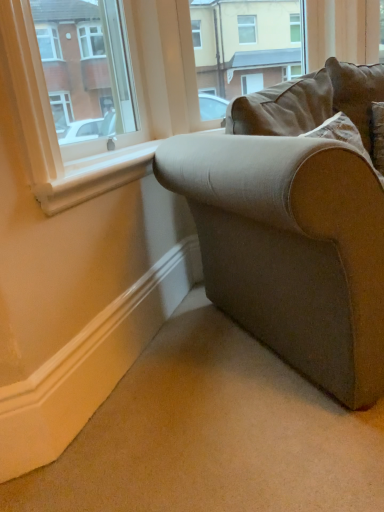
At what (x,y) coordinates should I click in order to perform the action: click on matte white window at upper left. Please return your answer as a coordinate pair (x, y). Looking at the image, I should click on (54, 129).

Locate an element on the screen. The width and height of the screenshot is (384, 512). brown fabric couch at upper right is located at coordinates pyautogui.click(x=244, y=46).

Where is `white painted wood at lower left`? This screenshot has width=384, height=512. white painted wood at lower left is located at coordinates (94, 176).

At what (x,y) coordinates should I click in order to perform the action: click on textured beige couch at lower right. Please return your answer as a coordinate pair (x, y). Looking at the image, I should click on (295, 225).

The width and height of the screenshot is (384, 512). Find the location of `matte white window at upper left`. matte white window at upper left is located at coordinates (54, 129).

Considering the relative sizes of brown fabric couch at upper right and matte white window at upper left in the image provided, is brown fabric couch at upper right bigger than matte white window at upper left?

No.

In terms of width, does brown fabric couch at upper right look wider or thinner when compared to matte white window at upper left?

Clearly, brown fabric couch at upper right has less width compared to matte white window at upper left.

From a real-world perspective, is brown fabric couch at upper right positioned under matte white window at upper left based on gravity?

Actually, brown fabric couch at upper right is physically above matte white window at upper left in the real world.

Does brown fabric couch at upper right appear on the right side of matte white window at upper left?

Correct, you'll find brown fabric couch at upper right to the right of matte white window at upper left.

Is white painted wood at lower left to the left or to the right of textured beige couch at lower right in the image?

Clearly, white painted wood at lower left is on the left of textured beige couch at lower right in the image.

Does point (132, 147) lie in front of point (318, 236)?

No, it is behind (318, 236).

Considering the sizes of objects white painted wood at lower left and textured beige couch at lower right in the image provided, who is shorter, white painted wood at lower left or textured beige couch at lower right?

white painted wood at lower left is shorter.

Is white painted wood at lower left behind textured beige couch at lower right?

Yes, the depth of white painted wood at lower left is greater than that of textured beige couch at lower right.

You are a GUI agent. You are given a task and a screenshot of the screen. Output one action in this format:
    pyautogui.click(x=<x>, y=<y>)
    Task: Click on the window sill that is behind the textured beige couch at lower right
    
    Given the screenshot: What is the action you would take?
    pyautogui.click(x=94, y=176)

From the image's perspective, who appears lower, textured beige couch at lower right or white painted wood at lower left?

From the image's view, textured beige couch at lower right is below.

Who is more distant, textured beige couch at lower right or white painted wood at lower left?

white painted wood at lower left is further away from the camera.

Considering the sizes of textured beige couch at lower right and matte white window at upper left in the image, is textured beige couch at lower right bigger or smaller than matte white window at upper left?

Clearly, textured beige couch at lower right is larger in size than matte white window at upper left.

Is textured beige couch at lower right to the left or to the right of matte white window at upper left in the image?

textured beige couch at lower right is to the right of matte white window at upper left.

Locate an element on the screen. The width and height of the screenshot is (384, 512). studio couch below the matte white window at upper left (from a real-world perspective) is located at coordinates (295, 225).

Is textured beige couch at lower right located outside matte white window at upper left?

Yes, textured beige couch at lower right is not within matte white window at upper left.

How many degrees apart are the facing directions of white painted wood at lower left and brown fabric couch at upper right?

The angular difference between white painted wood at lower left and brown fabric couch at upper right is 46.3 degrees.

Looking at this image, is white painted wood at lower left to the left of brown fabric couch at upper right from the viewer's perspective?

Yes.

From the image's perspective, is white painted wood at lower left beneath brown fabric couch at upper right?

Yes.

Based on the photo, from a real-world perspective, is white painted wood at lower left over brown fabric couch at upper right?

No, from a real-world perspective, white painted wood at lower left is not on top of brown fabric couch at upper right.

Would you say matte white window at upper left is outside brown fabric couch at upper right?

That's correct, matte white window at upper left is outside of brown fabric couch at upper right.

Which object is more forward, matte white window at upper left or brown fabric couch at upper right?

matte white window at upper left.

Between point (47, 166) and point (247, 88), which one is positioned in front?

The point (47, 166) is closer.

Is matte white window at upper left to the left or to the right of brown fabric couch at upper right in the image?

Clearly, matte white window at upper left is on the left of brown fabric couch at upper right in the image.

Is matte white window at upper left next to textured beige couch at lower right?

No, matte white window at upper left is not next to textured beige couch at lower right.

Visually, is matte white window at upper left positioned to the left or to the right of textured beige couch at lower right?

From the image, it's evident that matte white window at upper left is to the left of textured beige couch at lower right.

What's the angular difference between matte white window at upper left and textured beige couch at lower right's facing directions?

They differ by 46.6 degrees in their facing directions.

From a real-world perspective, is matte white window at upper left on top of textured beige couch at lower right?

Yes.

Where is `window frame on the right side of matte white window at upper left`? The image size is (384, 512). window frame on the right side of matte white window at upper left is located at coordinates pos(244,46).

In order to click on window sill above the textured beige couch at lower right (from a real-world perspective) in this screenshot , I will do `click(94, 176)`.

Consider the image. From the image, which object appears to be farther from matte white window at upper left, white painted wood at lower left or brown fabric couch at upper right?

brown fabric couch at upper right lies further to matte white window at upper left than the other object.

Considering their positions, is textured beige couch at lower right positioned closer to white painted wood at lower left than brown fabric couch at upper right?

textured beige couch at lower right is positioned closer to the anchor white painted wood at lower left.

When comparing their distances from textured beige couch at lower right, does brown fabric couch at upper right or matte white window at upper left seem closer?

matte white window at upper left is positioned closer to the anchor textured beige couch at lower right.

When comparing their distances from brown fabric couch at upper right, does textured beige couch at lower right or matte white window at upper left seem closer?

textured beige couch at lower right.

Estimate the real-world distances between objects in this image. Which object is further from matte white window at upper left, white painted wood at lower left or textured beige couch at lower right?

The object further to matte white window at upper left is textured beige couch at lower right.

Estimate the real-world distances between objects in this image. Which object is closer to textured beige couch at lower right, white painted wood at lower left or matte white window at upper left?

Among the two, white painted wood at lower left is located nearer to textured beige couch at lower right.

Which object lies nearer to the anchor point matte white window at upper left, textured beige couch at lower right or brown fabric couch at upper right?

The object closer to matte white window at upper left is textured beige couch at lower right.

Which object lies nearer to the anchor point textured beige couch at lower right, white painted wood at lower left or brown fabric couch at upper right?

white painted wood at lower left.

In order to click on window between textured beige couch at lower right and brown fabric couch at upper right along the z-axis in this screenshot , I will do `click(54, 129)`.

The width and height of the screenshot is (384, 512). In order to click on window sill between matte white window at upper left and textured beige couch at lower right in the horizontal direction in this screenshot , I will do `click(94, 176)`.

Where is `window sill between matte white window at upper left and brown fabric couch at upper right along the z-axis`? Image resolution: width=384 pixels, height=512 pixels. window sill between matte white window at upper left and brown fabric couch at upper right along the z-axis is located at coordinates (94, 176).

Identify the location of window sill between textured beige couch at lower right and brown fabric couch at upper right in the front-back direction. This screenshot has height=512, width=384. (94, 176).